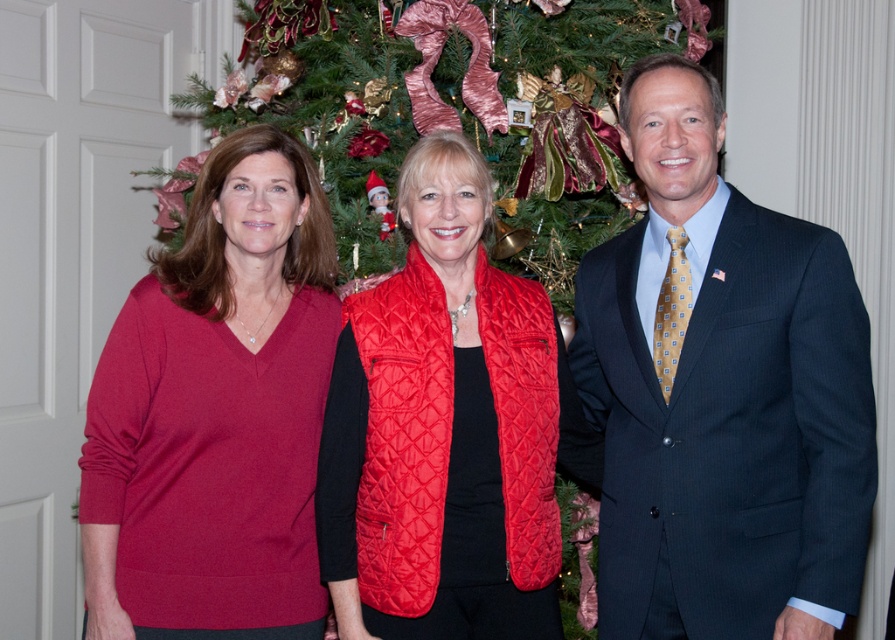
Is dark blue suit at center positioned in front of matte red sweater at left?

Yes, dark blue suit at center is closer to the viewer.

Does dark blue suit at center appear on the left side of matte red sweater at left?

In fact, dark blue suit at center is to the right of matte red sweater at left.

Does point (847, 342) come in front of point (133, 355)?

That is True.

Where is `dark blue suit at center`? The image size is (895, 640). dark blue suit at center is located at coordinates (721, 392).

Which is more to the right, dark blue suit at center or quilted red vest at center?

dark blue suit at center

Who is more forward, (840,372) or (441,474)?

Point (840,372) is in front.

The width and height of the screenshot is (895, 640). I want to click on dark blue suit at center, so click(721, 392).

Is dark blue suit at center in front of green textured christmas tree at center?

Yes, it is in front of green textured christmas tree at center.

Identify the location of dark blue suit at center. The width and height of the screenshot is (895, 640). (721, 392).

Who is more distant from viewer, (834,390) or (253,60)?

The point (253,60) is more distant.

The width and height of the screenshot is (895, 640). I want to click on dark blue suit at center, so (721, 392).